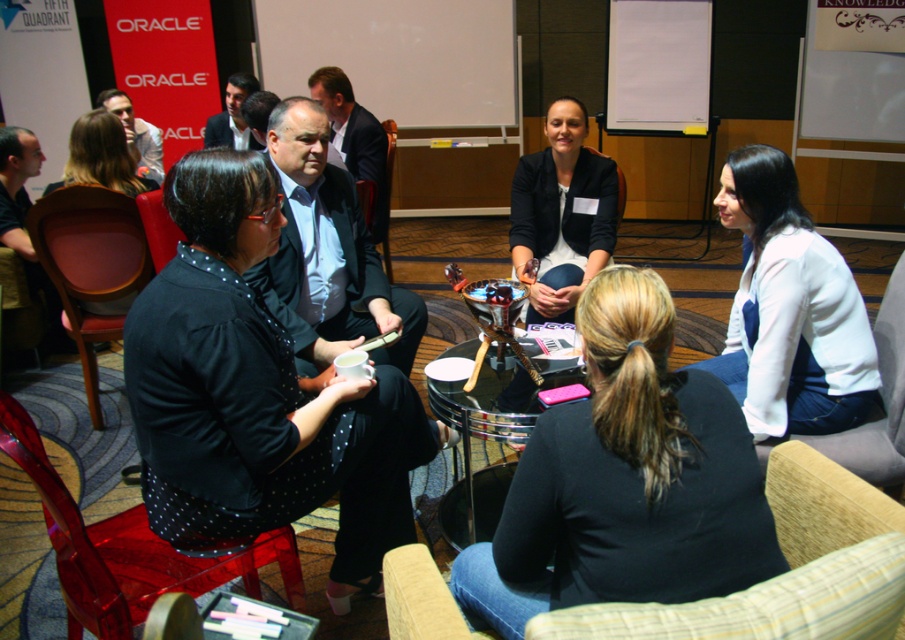
You are standing at the entrance of the conference room and want to locate the person wearing the black dotted shirt at left. According to the coordinates provided, where should you look to find them?

The black dotted shirt at left is located at coordinates point (101,156), so you should look towards the lower left area of the image to find them.

You are standing at the entrance of the conference room and want to sit down. Where is the dark blue fabric armchair at lower right located?

The dark blue fabric armchair at lower right is located at point (787, 573).